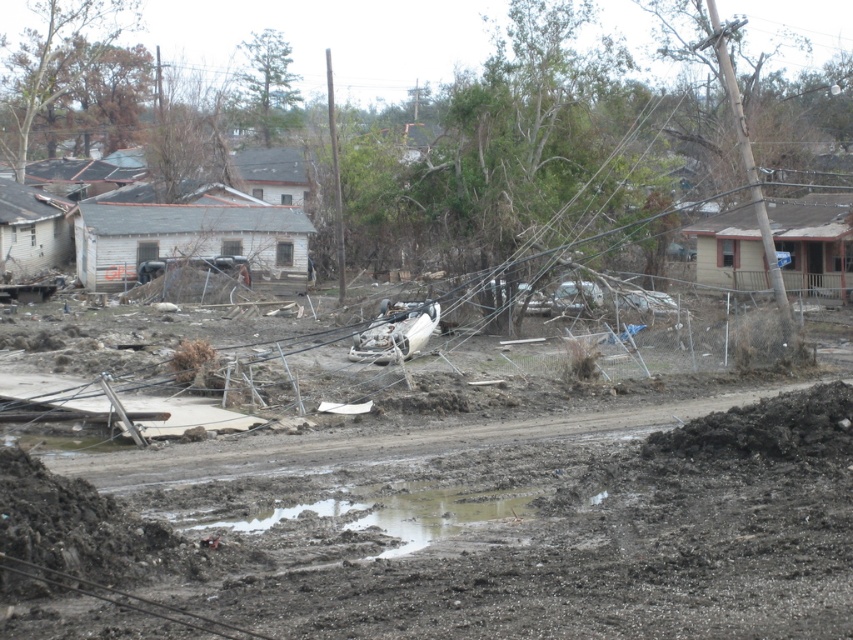
Question: Does muddy soil at center appear on the left side of muddy water at center?

Choices:
 (A) yes
 (B) no

Answer: (B)

Question: Which object is farther from the camera taking this photo?

Choices:
 (A) muddy water at center
 (B) muddy soil at center

Answer: (A)

Question: Is muddy soil at center positioned at the back of muddy water at center?

Choices:
 (A) no
 (B) yes

Answer: (A)

Question: Does muddy soil at center appear on the right side of muddy water at center?

Choices:
 (A) yes
 (B) no

Answer: (A)

Question: Which point is farther from the camera taking this photo?

Choices:
 (A) (364, 493)
 (B) (637, 481)

Answer: (B)

Question: Which point is farther to the camera?

Choices:
 (A) muddy soil at center
 (B) muddy water at center

Answer: (B)